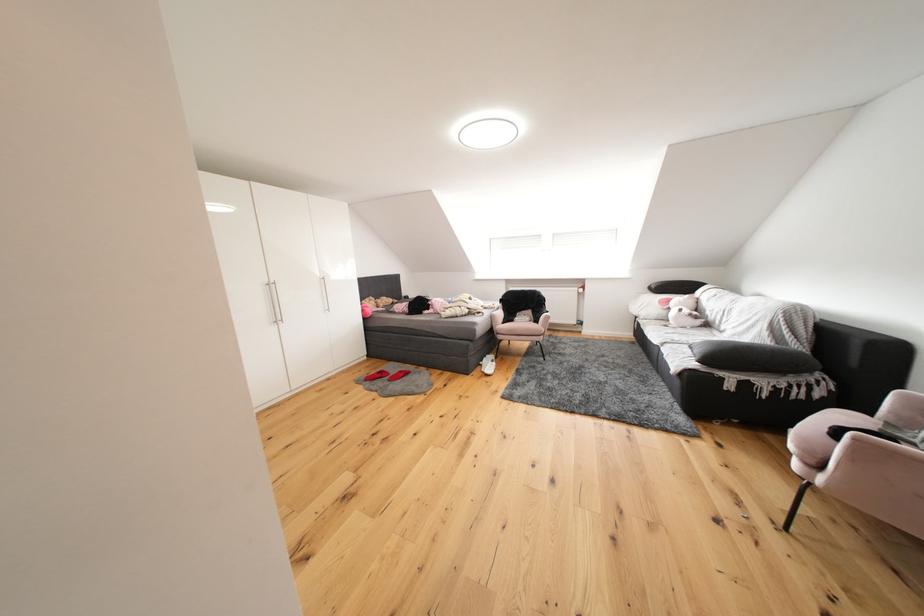
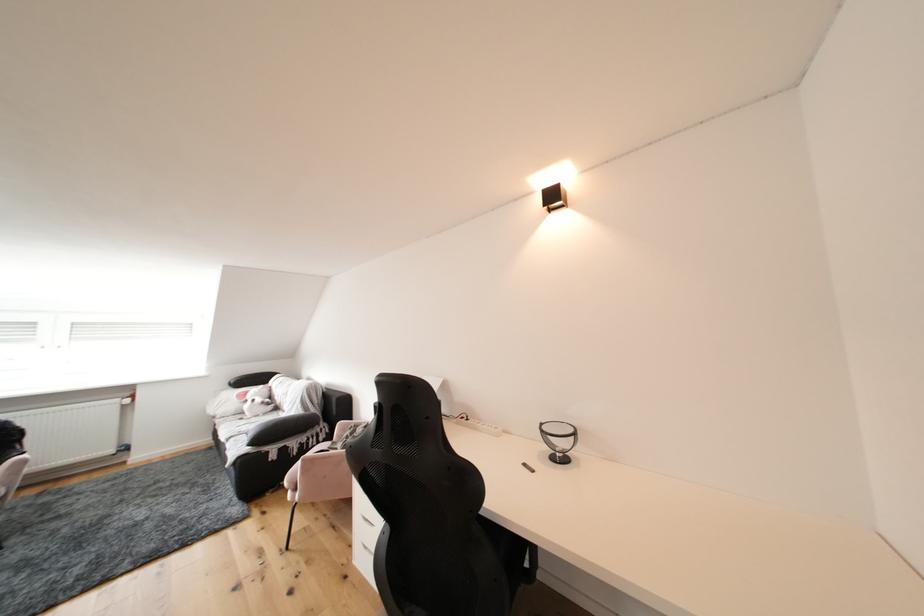
The point at (677, 305) is marked in the first image. Where is the corresponding point in the second image?

(256, 397)